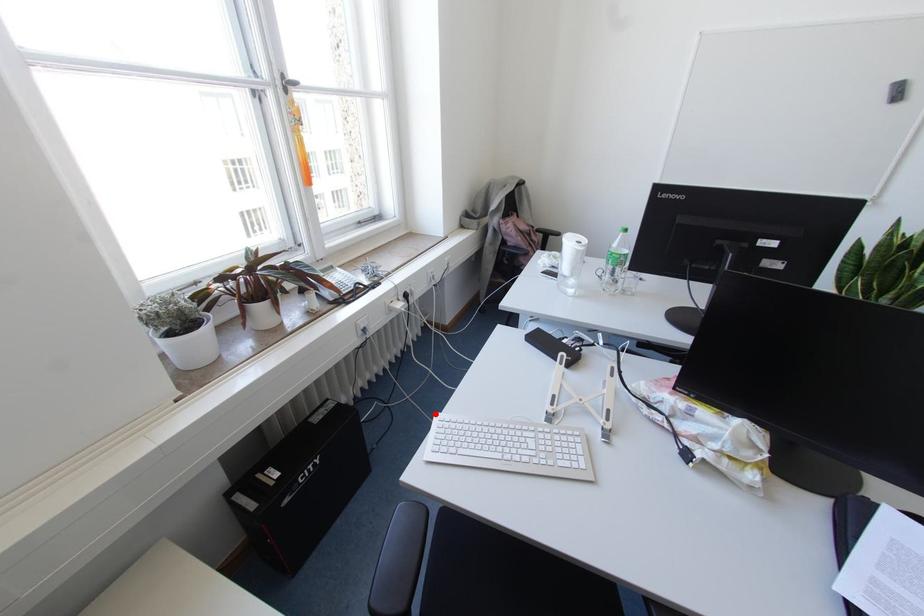
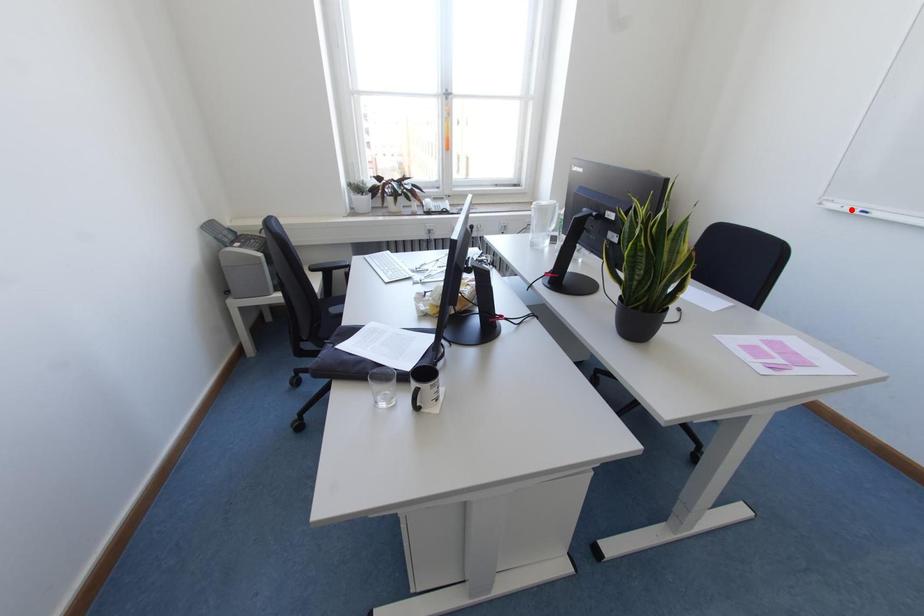
I am providing you with two images of the same scene from different viewpoints. A red point is marked on the first image and another point is marked on the second image. Does the point marked in image1 correspond to the same location as the one in image2?

No